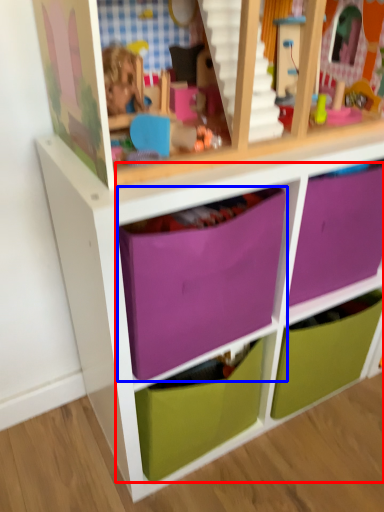
Question: Which point is further to the camera, drawer (highlighted by a red box) or drawer (highlighted by a blue box)?

Choices:
 (A) drawer
 (B) drawer

Answer: (B)